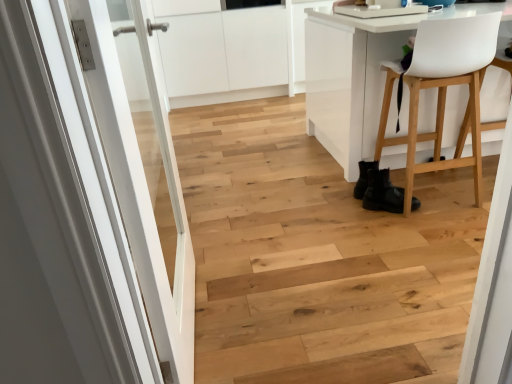
Where is `white glossy door at left`? white glossy door at left is located at coordinates (143, 181).

The width and height of the screenshot is (512, 384). I want to click on white plastic chair at right, so click(442, 89).

Where is `black leather boots at lower right`? This screenshot has height=384, width=512. black leather boots at lower right is located at coordinates (382, 192).

Visually, is black leather boots at lower right positioned to the left or to the right of white plastic chair at right?

From the image, it's evident that black leather boots at lower right is to the left of white plastic chair at right.

From their relative heights in the image, would you say black leather boots at lower right is taller or shorter than white plastic chair at right?

black leather boots at lower right is shorter than white plastic chair at right.

From the image's perspective, who appears lower, black leather boots at lower right or white plastic chair at right?

black leather boots at lower right, from the image's perspective.

Is point (469, 92) farther from viewer compared to point (148, 239)?

Yes.

The width and height of the screenshot is (512, 384). I want to click on door below the white plastic chair at right (from the image's perspective), so click(143, 181).

Which object is thinner, white plastic chair at right or white glossy door at left?

white glossy door at left is thinner.

Is white plastic chair at right touching white glossy door at left?

white plastic chair at right is not next to white glossy door at left, and they're not touching.

Which is more to the left, white glossy door at left or white plastic chair at right?

white glossy door at left is more to the left.

Looking at this image, would you consider white glossy door at left to be distant from white plastic chair at right?

white glossy door at left is far away from white plastic chair at right.

You are a GUI agent. You are given a task and a screenshot of the screen. Output one action in this format:
    pyautogui.click(x=<x>, y=<y>)
    Task: Click on the door below the white plastic chair at right (from the image's perspective)
    
    Given the screenshot: What is the action you would take?
    pyautogui.click(x=143, y=181)

From a real-world perspective, which object stands above the other?

white glossy door at left is physically above.

Measure the distance from black leather boots at lower right to white glossy door at left.

black leather boots at lower right and white glossy door at left are 3.67 feet apart.

From the image's perspective, who appears lower, black leather boots at lower right or white glossy door at left?

white glossy door at left, from the image's perspective.

Would you say black leather boots at lower right contains white glossy door at left?

Definitely not — white glossy door at left is not inside black leather boots at lower right.

From a real-world perspective, between black leather boots at lower right and white glossy door at left, who is vertically lower?

In real-world perspective, black leather boots at lower right is lower.

From the image's perspective, is white plastic chair at right above black leather boots at lower right?

Indeed, from the image's perspective, white plastic chair at right is shown above black leather boots at lower right.

The height and width of the screenshot is (384, 512). I want to click on footwear behind the white plastic chair at right, so click(382, 192).

How many degrees apart are the facing directions of white plastic chair at right and black leather boots at lower right?

white plastic chair at right and black leather boots at lower right are facing 110 degrees away from each other.

From the picture: Is there a large distance between white plastic chair at right and black leather boots at lower right?

No, there isn't a large distance between white plastic chair at right and black leather boots at lower right.

Locate an element on the screen. door that is on the left side of black leather boots at lower right is located at coordinates (143, 181).

Between white glossy door at left and black leather boots at lower right, which one appears on the right side from the viewer's perspective?

black leather boots at lower right is more to the right.

In terms of height, does white glossy door at left look taller or shorter compared to black leather boots at lower right?

In the image, white glossy door at left appears to be taller than black leather boots at lower right.

Between white glossy door at left and black leather boots at lower right, which one has smaller width?

Thinner between the two is white glossy door at left.

Find the location of `footwear behind the white plastic chair at right`. footwear behind the white plastic chair at right is located at coordinates (382, 192).

Find the location of a particular element. chair on the right of white glossy door at left is located at coordinates (442, 89).

Which object lies further to the anchor point white plastic chair at right, black leather boots at lower right or white glossy door at left?

The object further to white plastic chair at right is white glossy door at left.

Looking at this image, which object lies further to the anchor point white glossy door at left, black leather boots at lower right or white plastic chair at right?

Among the two, white plastic chair at right is located further to white glossy door at left.

From the image, which object appears to be farther from black leather boots at lower right, white plastic chair at right or white glossy door at left?

Among the two, white glossy door at left is located further to black leather boots at lower right.

Looking at the image, which one is located further to black leather boots at lower right, white glossy door at left or white plastic chair at right?

white glossy door at left.

Which object lies further to the anchor point white glossy door at left, white plastic chair at right or black leather boots at lower right?

white plastic chair at right.

Based on the photo, estimate the real-world distances between objects in this image. Which object is closer to white plastic chair at right, white glossy door at left or black leather boots at lower right?

Based on the image, black leather boots at lower right appears to be nearer to white plastic chair at right.

This screenshot has width=512, height=384. Identify the location of chair positioned between white glossy door at left and black leather boots at lower right from near to far. (442, 89).